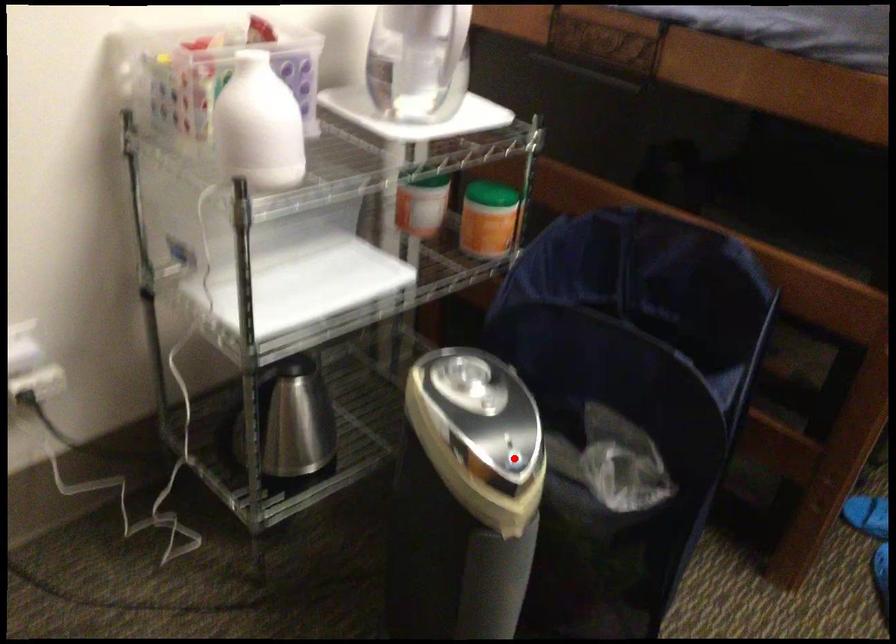
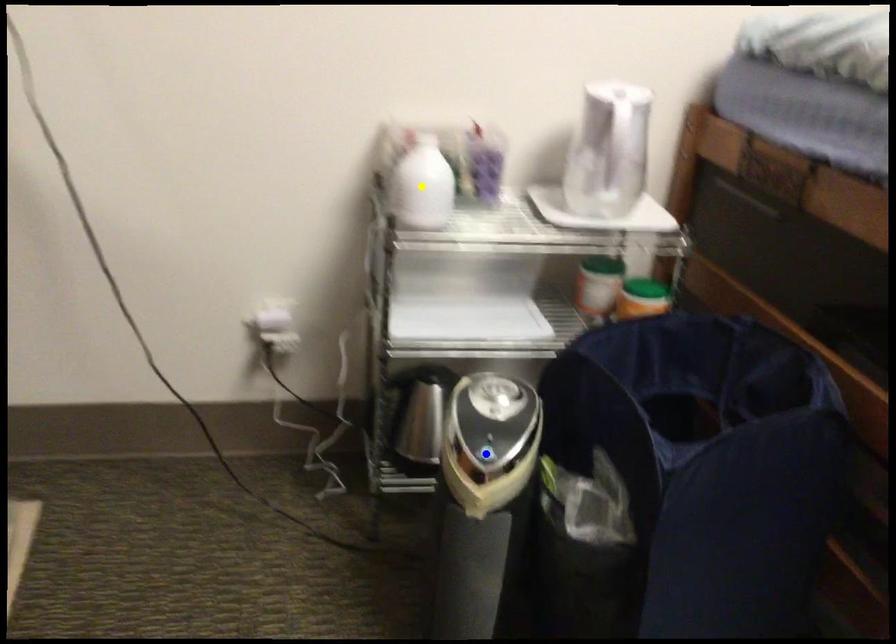
Question: I am providing you with two images of the same scene from different viewpoints. A red point is marked on the first image. You are given multiple points on the second image. In image 2, which mark is for the same physical point as the one in image 1?

Choices:
 (A) green point
 (B) yellow point
 (C) blue point

Answer: (C)